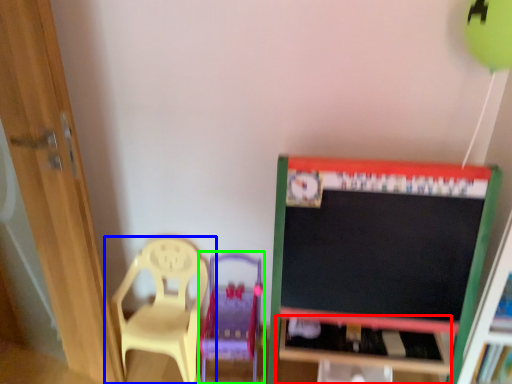
Question: Which object is the farthest from table (highlighted by a red box)? Choose among these: chair (highlighted by a blue box) or swivel chair (highlighted by a green box).

Choices:
 (A) chair
 (B) swivel chair

Answer: (A)